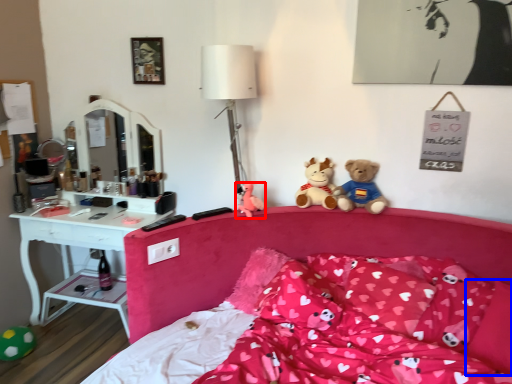
Question: Which of the following is the closest to the observer, toy (highlighted by a red box) or pillow (highlighted by a blue box)?

Choices:
 (A) toy
 (B) pillow

Answer: (B)